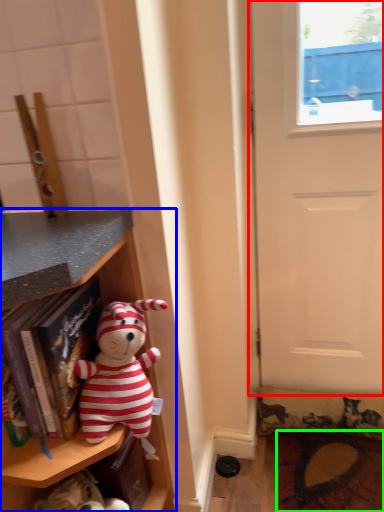
Question: Based on their relative distances, which object is nearer to door (highlighted by a red box)? Choose from shelf (highlighted by a blue box) and doormat (highlighted by a green box).

Choices:
 (A) shelf
 (B) doormat

Answer: (B)